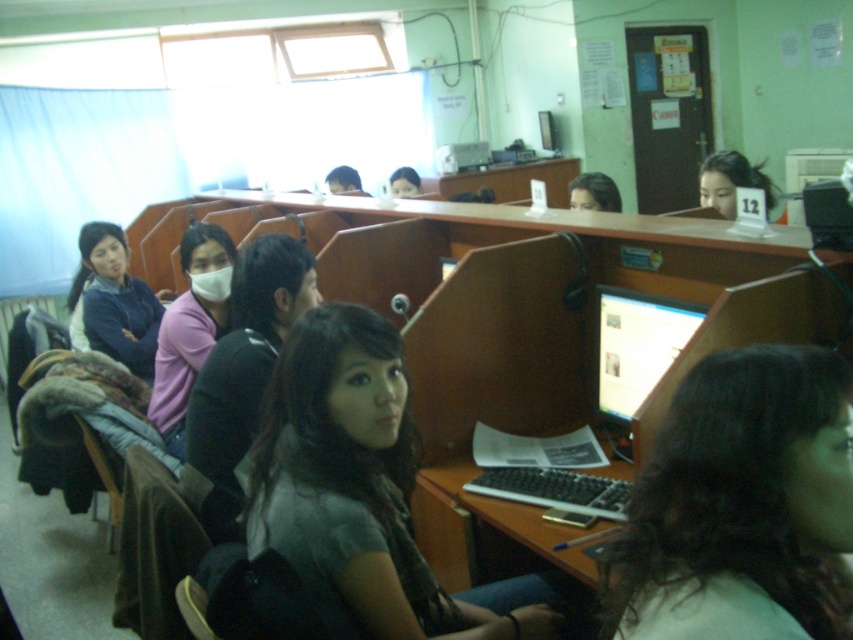
Question: Does dark brown hair at center have a greater width compared to pink matte shirt at center?

Choices:
 (A) yes
 (B) no

Answer: (B)

Question: Can you confirm if matte black laptop at center is positioned below smooth skin face at center?

Choices:
 (A) yes
 (B) no

Answer: (A)

Question: Which point is farther to the camera?

Choices:
 (A) pink matte shirt at center
 (B) smooth skin face at center
 (C) matte black cap at upper center

Answer: (B)

Question: Which point is closer to the camera?

Choices:
 (A) white matte mask at center
 (B) smooth skin face at center
 (C) pink matte shirt at center
 (D) matte black cap at upper center

Answer: (C)

Question: Which point is closer to the camera?

Choices:
 (A) (341, 177)
 (B) (779, 515)
 (C) (88, 256)

Answer: (B)

Question: Where is matte black laptop at center located in relation to smooth skin face at center in the image?

Choices:
 (A) right
 (B) left

Answer: (A)